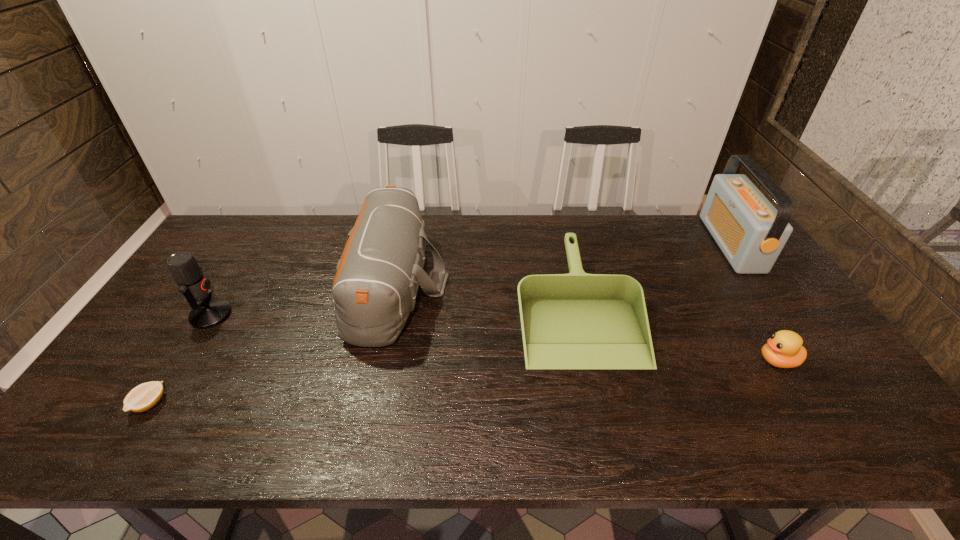
Locate an element on the screen. free space at the far left corner of the desktop is located at coordinates (241, 224).

Find the location of a particular element. This screenshot has width=960, height=540. free space at the near right corner of the desktop is located at coordinates click(894, 439).

Identify the location of blank region between the tallest object and the nearest object. The image size is (960, 540). coord(441,324).

Image resolution: width=960 pixels, height=540 pixels. Identify the location of free space between the shortest object and the duckling. (464, 382).

The width and height of the screenshot is (960, 540). Find the location of `free spot between the fourth object from left to right and the third object from left to right`. free spot between the fourth object from left to right and the third object from left to right is located at coordinates (486, 295).

Identify the location of vacant area that lies between the shortest object and the duffel bag. (273, 344).

Image resolution: width=960 pixels, height=540 pixels. Find the location of `free space between the microphone and the duckling`. free space between the microphone and the duckling is located at coordinates (494, 338).

Image resolution: width=960 pixels, height=540 pixels. Identify the location of vacant space that is in between the duckling and the microphone. (494, 338).

Find the location of `free space between the lemon and the fourth object from left to right`. free space between the lemon and the fourth object from left to right is located at coordinates (364, 355).

Identify which object is the fourth nearest to the shortest object. Please provide its 2D coordinates. Your answer should be formatted as a tuple, i.e. [(x, y)], where the tuple contains the x and y coordinates of a point satisfying the conditions above.

[(784, 349)]